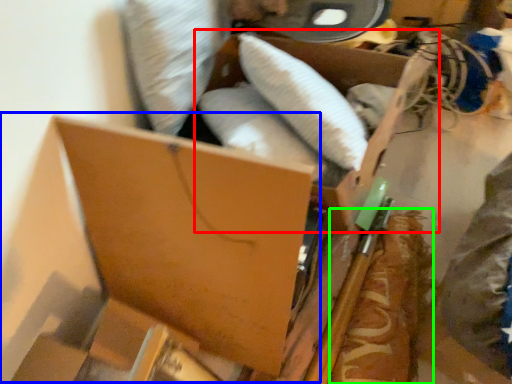
Question: Considering the real-world distances, which object is closest to storage box (highlighted by a red box)? storage box (highlighted by a blue box) or food (highlighted by a green box).

Choices:
 (A) storage box
 (B) food

Answer: (B)